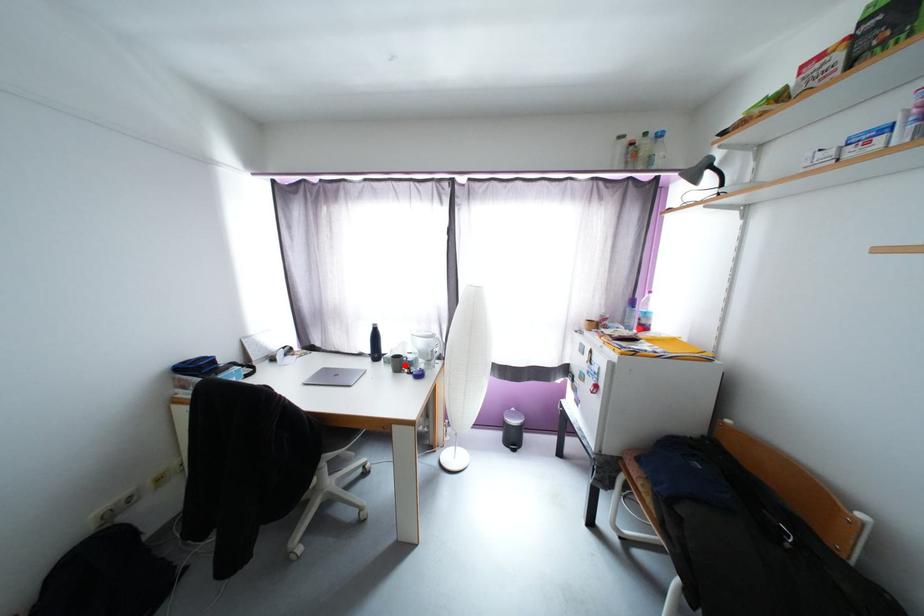
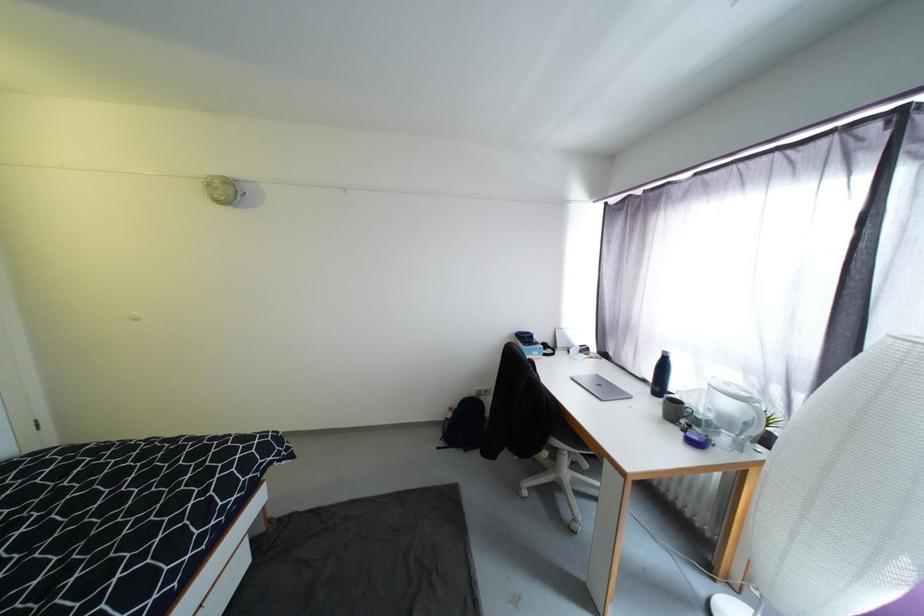
Question: I am providing you with two images of the same scene from different viewpoints. In image1, a red point is highlighted. Considering the same 3D point in image2, which of the following is correct?

Choices:
 (A) It is closer
 (B) It is farther

Answer: (A)